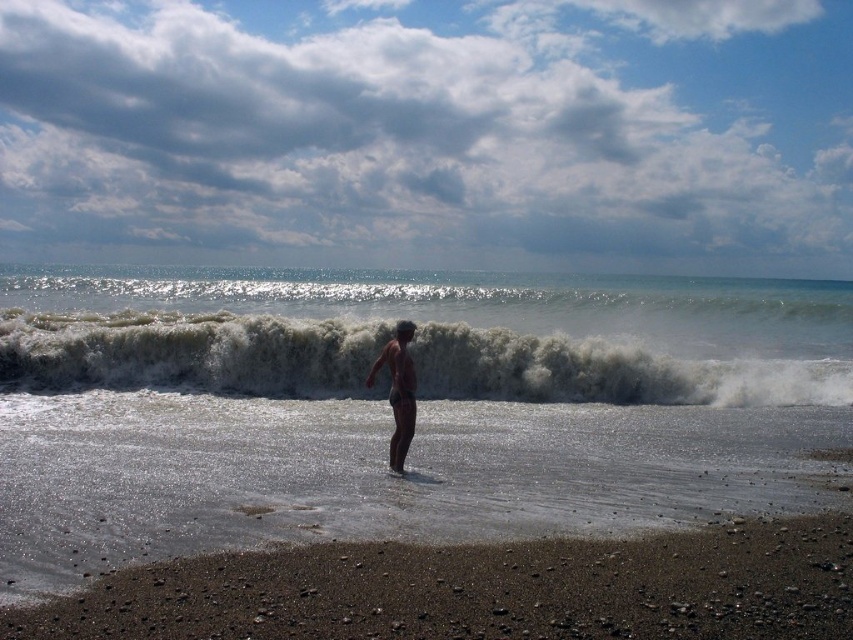
You are a photographer trying to capture the brown matte skin at center and dark brown pebbles at lower center in the same frame. Which object would appear larger in the photo?

The brown matte skin at center would appear larger in the photo because it is bigger than the dark brown pebbles at lower center.

You are a photographer trying to capture the entire scene of the white frothy wave at center and the brown matte skin at center in one photo. Based on their sizes, which object will appear larger in the photo?

→ The white frothy wave at center will appear larger in the photo because its width surpasses that of the brown matte skin at center, as stated in the description.